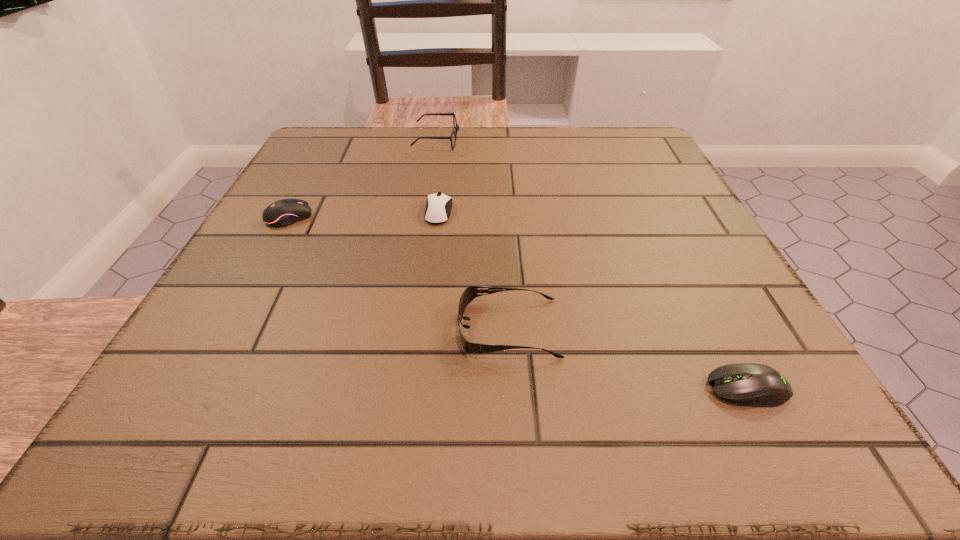
Where is `object that is the fourth closest one to the sunglasses`? The width and height of the screenshot is (960, 540). object that is the fourth closest one to the sunglasses is located at coordinates (456, 127).

Find the location of a particular element. The height and width of the screenshot is (540, 960). computer mouse that is the third closest one to the farthest object is located at coordinates (748, 384).

You are a GUI agent. You are given a task and a screenshot of the screen. Output one action in this format:
    pyautogui.click(x=<x>, y=<y>)
    Task: Click on the computer mouse that stands as the second closest to the second computer mouse from left to right
    Image resolution: width=960 pixels, height=540 pixels.
    Given the screenshot: What is the action you would take?
    pyautogui.click(x=748, y=384)

Where is `vacant space that satisfies the following two spatial constraints: 1. on the back side of the second computer mouse from right to left; 2. on the right side of the leftmost object`? The height and width of the screenshot is (540, 960). vacant space that satisfies the following two spatial constraints: 1. on the back side of the second computer mouse from right to left; 2. on the right side of the leftmost object is located at coordinates (293, 212).

Image resolution: width=960 pixels, height=540 pixels. Identify the location of vacant space that satisfies the following two spatial constraints: 1. on the front-facing side of the tallest object; 2. on the left side of the second computer mouse from right to left. (425, 212).